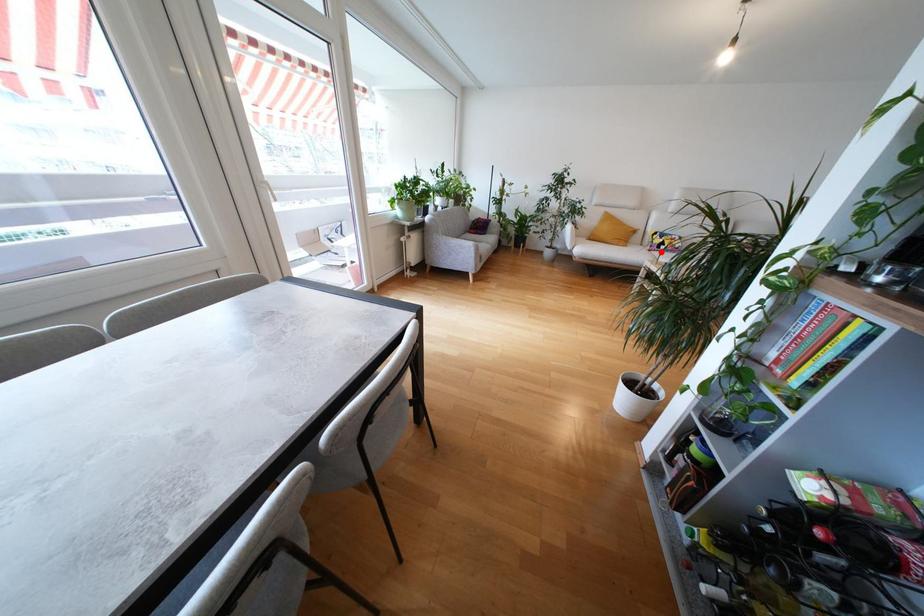
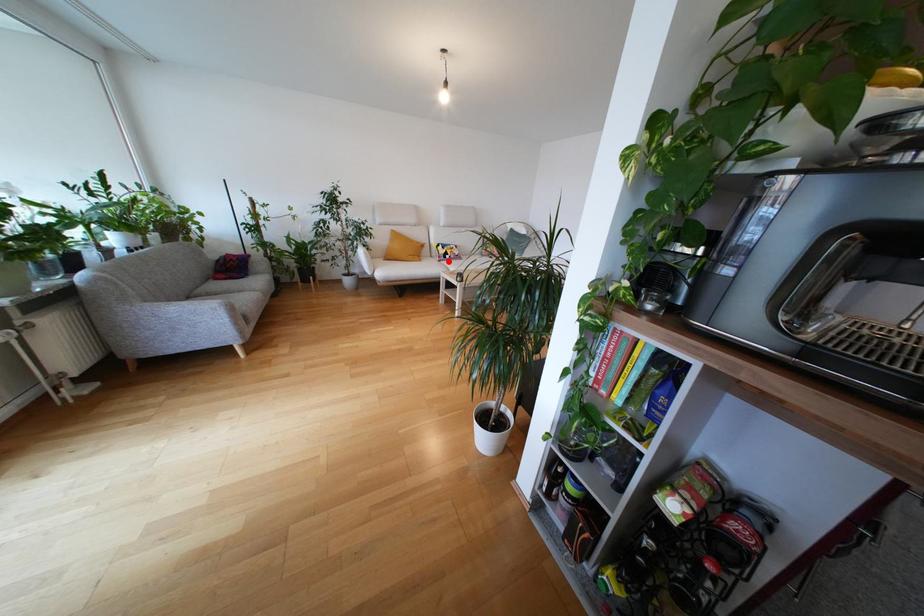
I am providing you with two images of the same scene from different viewpoints. A red point is marked on the first image and another point is marked on the second image. Is the red point in image1 aligned with the point shown in image2?

Yes